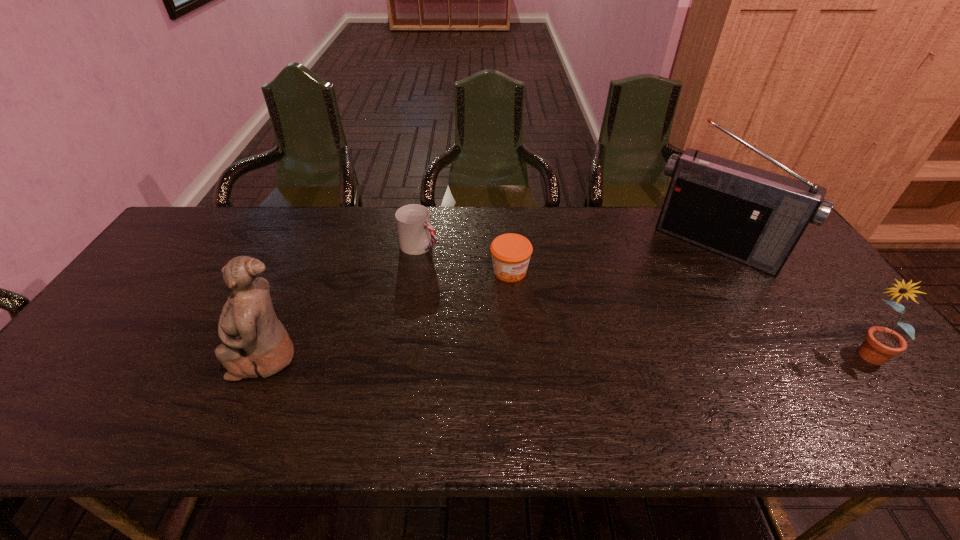
This screenshot has width=960, height=540. Identify the location of free region at the left edge. (171, 306).

Identify the location of free space at the far left corner of the desktop. (205, 235).

The width and height of the screenshot is (960, 540). Find the location of `free spot at the near left corner of the desktop`. free spot at the near left corner of the desktop is located at coordinates (114, 381).

This screenshot has height=540, width=960. What are the coordinates of `free spot between the fourth object from right to left and the third object from left to right` in the screenshot? It's located at (465, 259).

The width and height of the screenshot is (960, 540). What are the coordinates of `free point between the radio receiver and the shortest object` in the screenshot? It's located at (612, 259).

Locate an element on the screen. This screenshot has height=540, width=960. empty space between the fourth object from right to left and the third tallest object is located at coordinates (641, 301).

This screenshot has height=540, width=960. What are the coordinates of `unoccupied position between the shortest object and the third tallest object` in the screenshot? It's located at 686,314.

Where is `vacant point located between the radio receiver and the third tallest object`? The width and height of the screenshot is (960, 540). vacant point located between the radio receiver and the third tallest object is located at coordinates (789, 301).

Where is `free space that is in between the third object from right to left and the fourth shortest object`? This screenshot has height=540, width=960. free space that is in between the third object from right to left and the fourth shortest object is located at coordinates (389, 313).

The width and height of the screenshot is (960, 540). In order to click on vacant region between the leftmost object and the tallest object in this screenshot , I will do `click(492, 301)`.